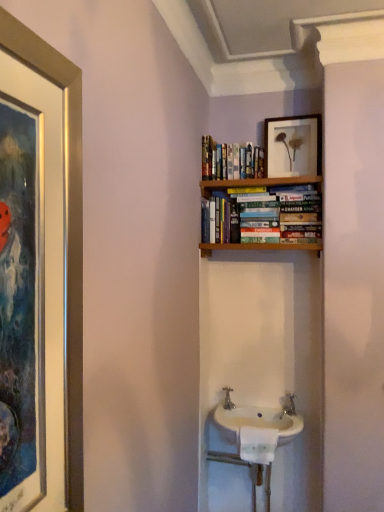
Question: Does hardcover books at upper center touch silver metallic tap at center?

Choices:
 (A) yes
 (B) no

Answer: (B)

Question: Would you say hardcover books at upper center is a long distance from silver metallic tap at center?

Choices:
 (A) no
 (B) yes

Answer: (B)

Question: Is hardcover books at upper center oriented away from silver metallic tap at center?

Choices:
 (A) yes
 (B) no

Answer: (B)

Question: Considering the relative positions of hardcover books at upper center and silver metallic tap at center in the image provided, is hardcover books at upper center to the right of silver metallic tap at center from the viewer's perspective?

Choices:
 (A) no
 (B) yes

Answer: (B)

Question: Is hardcover books at upper center smaller than silver metallic tap at center?

Choices:
 (A) yes
 (B) no

Answer: (B)

Question: Do you think silver metallic tap at center is within white ceramic sink at center, or outside of it?

Choices:
 (A) outside
 (B) inside

Answer: (A)

Question: Is silver metallic tap at center bigger or smaller than white ceramic sink at center?

Choices:
 (A) big
 (B) small

Answer: (B)

Question: From a real-world perspective, is silver metallic tap at center positioned above or below white ceramic sink at center?

Choices:
 (A) above
 (B) below

Answer: (A)

Question: Visually, is silver metallic tap at center positioned to the left or to the right of white ceramic sink at center?

Choices:
 (A) left
 (B) right

Answer: (A)

Question: Considering the positions of point (314, 160) and point (203, 138), is point (314, 160) closer or farther from the camera than point (203, 138)?

Choices:
 (A) farther
 (B) closer

Answer: (B)

Question: In terms of size, does matte wooden picture frame at upper center appear bigger or smaller than hardcover books at upper center?

Choices:
 (A) small
 (B) big

Answer: (A)

Question: Looking at their shapes, would you say matte wooden picture frame at upper center is wider or thinner than hardcover books at upper center?

Choices:
 (A) thin
 (B) wide

Answer: (A)

Question: Choose the correct answer: Is matte wooden picture frame at upper center inside hardcover books at upper center or outside it?

Choices:
 (A) inside
 (B) outside

Answer: (B)

Question: Is white ceramic sink at center spatially inside matte wooden picture frame at upper center, or outside of it?

Choices:
 (A) inside
 (B) outside

Answer: (B)

Question: Looking at the image, does white ceramic sink at center seem bigger or smaller compared to matte wooden picture frame at upper center?

Choices:
 (A) big
 (B) small

Answer: (A)